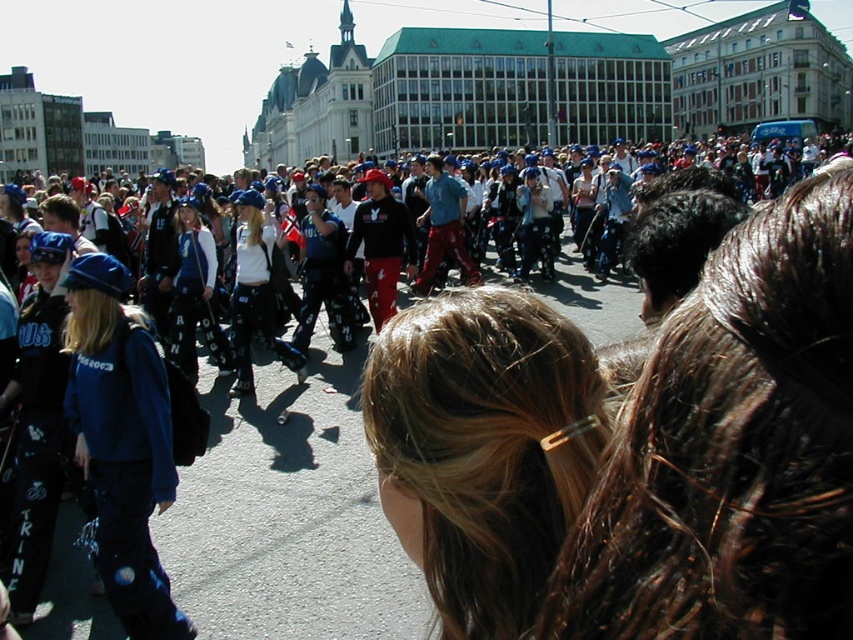
Question: Does matte blue jacket at left appear over black textured pants at center?

Choices:
 (A) yes
 (B) no

Answer: (B)

Question: Can you confirm if brown hair at center is positioned to the left of matte black hoodie at center?

Choices:
 (A) no
 (B) yes

Answer: (A)

Question: Is matte blue jacket at left to the right of matte black hoodie at center from the viewer's perspective?

Choices:
 (A) yes
 (B) no

Answer: (B)

Question: Which point is farther to the camera?

Choices:
 (A) (245, 232)
 (B) (160, 438)
 (C) (465, 492)

Answer: (A)

Question: Among these points, which one is farthest from the camera?

Choices:
 (A) (492, 317)
 (B) (384, 244)

Answer: (B)

Question: Considering the real-world distances, which object is farthest from the brown hair at center?

Choices:
 (A) matte blue jacket at left
 (B) matte black hoodie at center

Answer: (B)